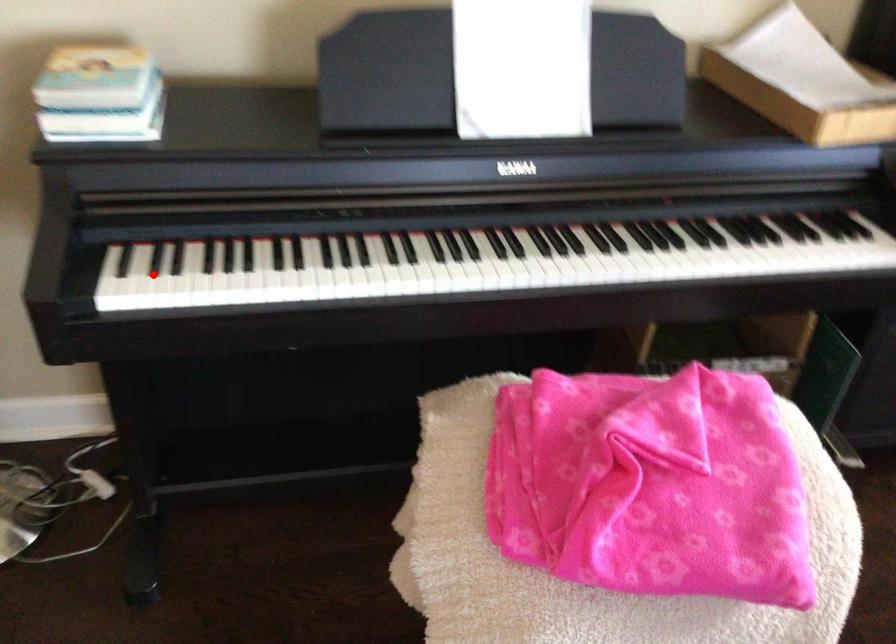
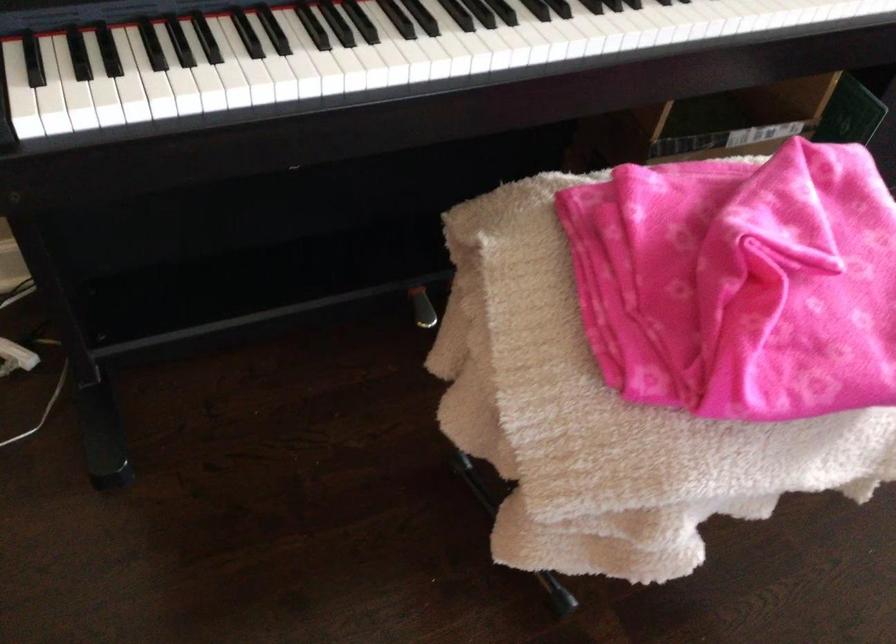
The point at the highlighted location is marked in the first image. Where is the corresponding point in the second image?

(87, 80)